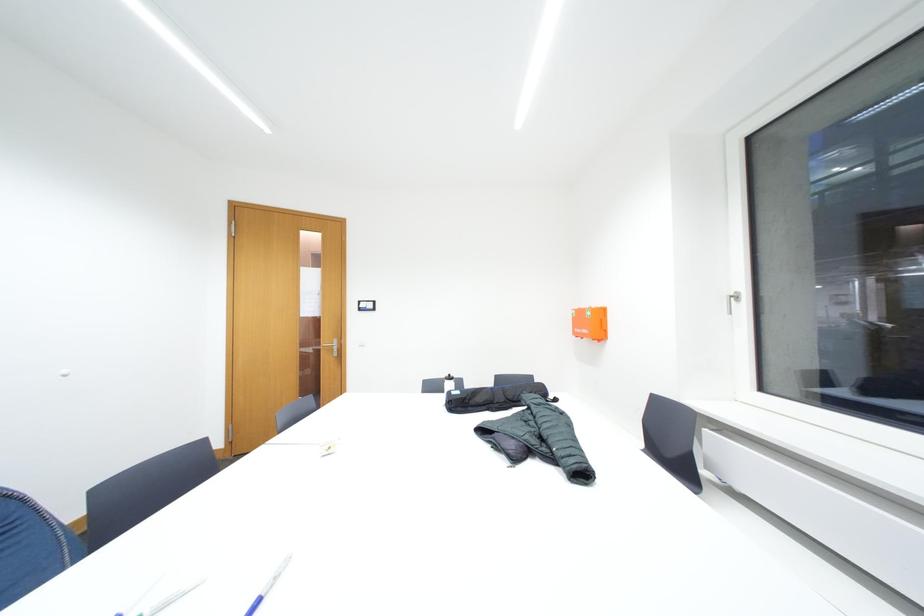
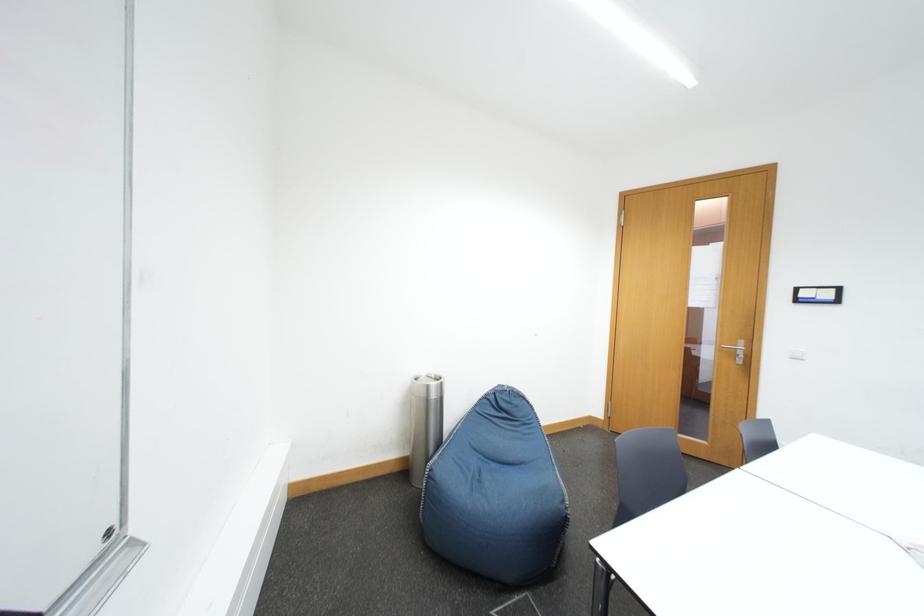
Question: Based on the continuous images, in which direction is the camera rotating? Reply with the corresponding letter.

Choices:
 (A) Left
 (B) Right
 (C) Up
 (D) Down

Answer: (A)